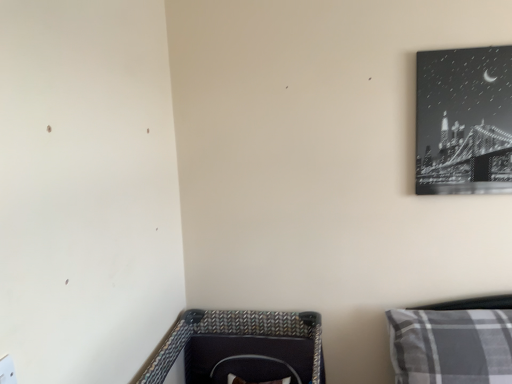
The height and width of the screenshot is (384, 512). What are the coordinates of `gray plaid pillow at lower right` in the screenshot? It's located at (451, 346).

The height and width of the screenshot is (384, 512). Describe the element at coordinates (451, 346) in the screenshot. I see `gray plaid pillow at lower right` at that location.

This screenshot has width=512, height=384. In order to click on black glossy canvas at upper right in this screenshot , I will do `click(464, 121)`.

What do you see at coordinates (464, 121) in the screenshot? I see `black glossy canvas at upper right` at bounding box center [464, 121].

This screenshot has height=384, width=512. I want to click on gray plaid pillow at lower right, so click(451, 346).

Considering the positions of objects black glossy canvas at upper right and gray plaid pillow at lower right in the image provided, who is more to the left, black glossy canvas at upper right or gray plaid pillow at lower right?

Positioned to the left is gray plaid pillow at lower right.

Between black glossy canvas at upper right and gray plaid pillow at lower right, which one is positioned in front?

gray plaid pillow at lower right.

Is point (425, 163) closer or farther from the camera than point (493, 327)?

Point (425, 163) appears to be farther away from the viewer than point (493, 327).

From the image's perspective, is black glossy canvas at upper right located above or below gray plaid pillow at lower right?

From the image's perspective, black glossy canvas at upper right appears above gray plaid pillow at lower right.

From the picture: From a real-world perspective, is black glossy canvas at upper right beneath gray plaid pillow at lower right?

Actually, black glossy canvas at upper right is physically above gray plaid pillow at lower right in the real world.

Which of these two, black glossy canvas at upper right or gray plaid pillow at lower right, is wider?

gray plaid pillow at lower right.

In terms of height, does black glossy canvas at upper right look taller or shorter compared to gray plaid pillow at lower right?

black glossy canvas at upper right is taller than gray plaid pillow at lower right.

Does black glossy canvas at upper right have a smaller size compared to gray plaid pillow at lower right?

Correct, black glossy canvas at upper right occupies less space than gray plaid pillow at lower right.

In the scene shown: Is black glossy canvas at upper right outside of gray plaid pillow at lower right?

Absolutely, black glossy canvas at upper right is external to gray plaid pillow at lower right.

Are black glossy canvas at upper right and gray plaid pillow at lower right beside each other?

No, black glossy canvas at upper right is not touching gray plaid pillow at lower right.

Is black glossy canvas at upper right facing towards gray plaid pillow at lower right?

No, black glossy canvas at upper right is not aimed at gray plaid pillow at lower right.

How much distance is there between black glossy canvas at upper right and gray plaid pillow at lower right?

A distance of 27.85 inches exists between black glossy canvas at upper right and gray plaid pillow at lower right.

Find the location of a particular element. pillow in front of the black glossy canvas at upper right is located at coordinates (451, 346).

Consider the image. Considering the relative positions of gray plaid pillow at lower right and black glossy canvas at upper right in the image provided, is gray plaid pillow at lower right to the right of black glossy canvas at upper right from the viewer's perspective?

Incorrect, gray plaid pillow at lower right is not on the right side of black glossy canvas at upper right.

Considering their positions, is gray plaid pillow at lower right located in front of or behind black glossy canvas at upper right?

gray plaid pillow at lower right is in front of black glossy canvas at upper right.

Does point (439, 369) lie behind point (446, 87)?

That is False.

From the image's perspective, who appears lower, gray plaid pillow at lower right or black glossy canvas at upper right?

gray plaid pillow at lower right appears lower in the image.

From a real-world perspective, between gray plaid pillow at lower right and black glossy canvas at upper right, who is vertically lower?

gray plaid pillow at lower right, from a real-world perspective.

Which object is thinner, gray plaid pillow at lower right or black glossy canvas at upper right?

black glossy canvas at upper right.

Can you confirm if gray plaid pillow at lower right is shorter than black glossy canvas at upper right?

Yes, gray plaid pillow at lower right is shorter than black glossy canvas at upper right.

In terms of size, does gray plaid pillow at lower right appear bigger or smaller than black glossy canvas at upper right?

Clearly, gray plaid pillow at lower right is larger in size than black glossy canvas at upper right.

Would you say gray plaid pillow at lower right is inside or outside black glossy canvas at upper right?

gray plaid pillow at lower right cannot be found inside black glossy canvas at upper right.

Is gray plaid pillow at lower right placed right next to black glossy canvas at upper right?

gray plaid pillow at lower right and black glossy canvas at upper right are clearly separated.

Is gray plaid pillow at lower right positioned with its back to black glossy canvas at upper right?

gray plaid pillow at lower right is not turned away from black glossy canvas at upper right.

Locate an element on the screen. The height and width of the screenshot is (384, 512). picture frame located above the gray plaid pillow at lower right (from a real-world perspective) is located at coordinates pyautogui.click(x=464, y=121).

This screenshot has width=512, height=384. Find the location of `picture frame located above the gray plaid pillow at lower right (from a real-world perspective)`. picture frame located above the gray plaid pillow at lower right (from a real-world perspective) is located at coordinates 464,121.

Find the location of a particular element. pillow on the left of black glossy canvas at upper right is located at coordinates (451, 346).